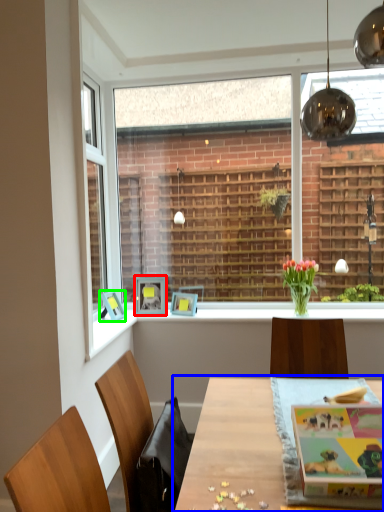
Question: Based on their relative distances, which object is nearer to picture frame (highlighted by a red box)? Choose from table (highlighted by a blue box) and picture frame (highlighted by a green box).

Choices:
 (A) table
 (B) picture frame

Answer: (B)